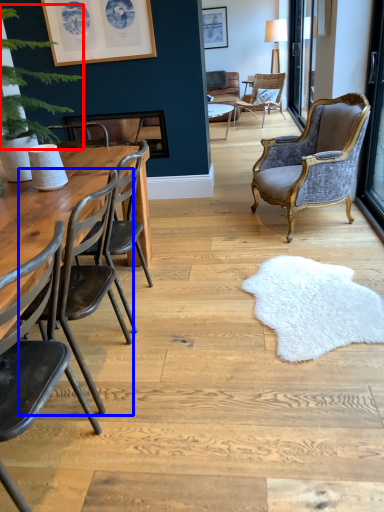
Question: Which object appears farthest to the camera in this image, plant (highlighted by a red box) or chair (highlighted by a blue box)?

Choices:
 (A) plant
 (B) chair

Answer: (A)